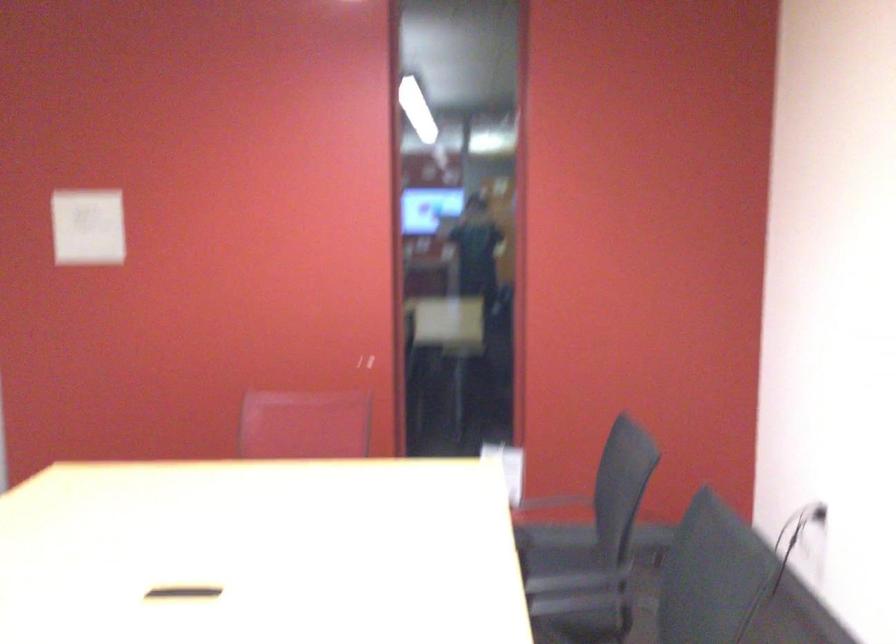
First-person continuous shooting, in which direction is the camera rotating?

The rotation direction of the camera is left-down.